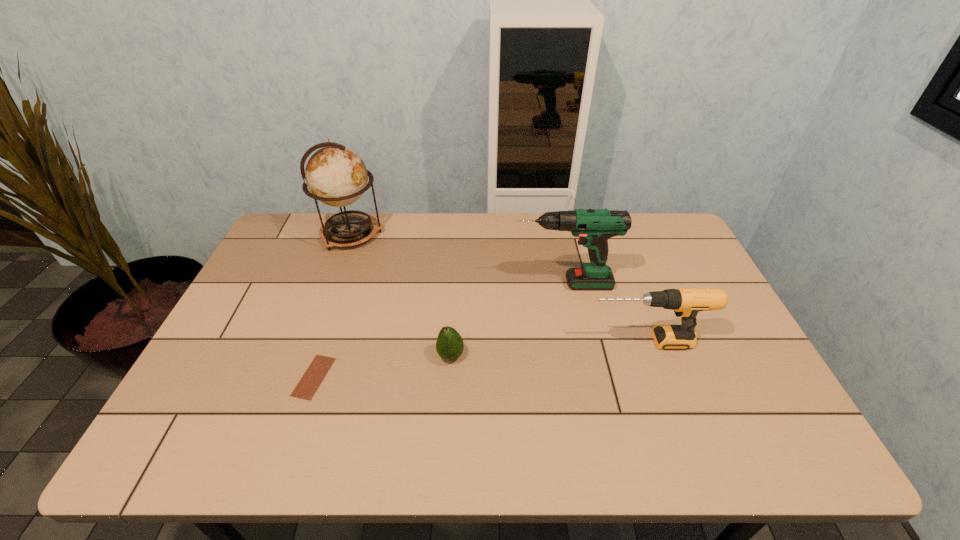
Locate an element on the screen. the tallest object is located at coordinates (335, 175).

Locate an element on the screen. The height and width of the screenshot is (540, 960). the farthest object is located at coordinates (335, 175).

Find the location of a particular element. the farther drill is located at coordinates (594, 227).

Find the location of a particular element. The height and width of the screenshot is (540, 960). the second tallest object is located at coordinates (594, 227).

Image resolution: width=960 pixels, height=540 pixels. Identify the location of the shorter drill. (686, 302).

I want to click on the third shortest object, so click(686, 302).

Where is `avocado`? This screenshot has width=960, height=540. avocado is located at coordinates (449, 345).

At what (x,y) coordinates should I click in order to perform the action: click on the third object from left to right. Please return your answer as a coordinate pair (x, y). This screenshot has width=960, height=540. Looking at the image, I should click on (449, 345).

The width and height of the screenshot is (960, 540). I want to click on the shortest object, so click(307, 386).

Identify the location of free space located 0.240m at the center of the tallest object. (452, 234).